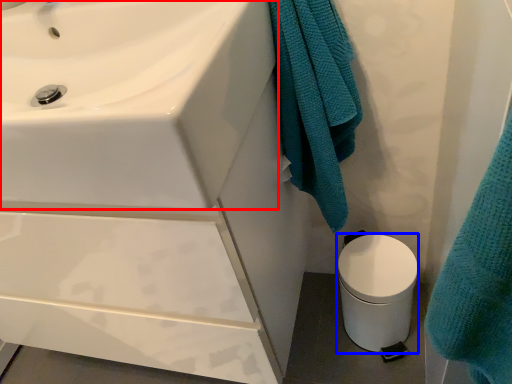
Question: Which object appears farthest to the camera in this image, sink (highlighted by a red box) or toilet bowl (highlighted by a blue box)?

Choices:
 (A) sink
 (B) toilet bowl

Answer: (B)